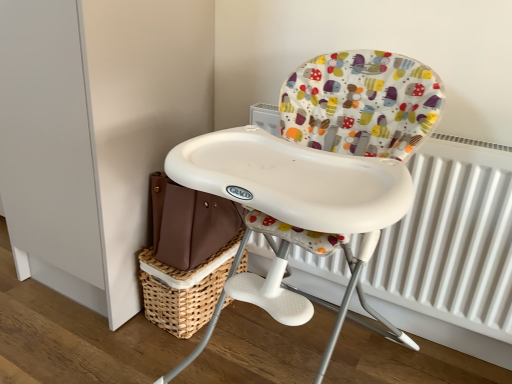
Question: Does white plastic highchair at center have a lesser height compared to woven brown basket at lower center?

Choices:
 (A) yes
 (B) no

Answer: (B)

Question: Is white plastic highchair at center thinner than woven brown basket at lower center?

Choices:
 (A) yes
 (B) no

Answer: (B)

Question: From a real-world perspective, is white plastic highchair at center positioned under woven brown basket at lower center based on gravity?

Choices:
 (A) yes
 (B) no

Answer: (B)

Question: Does white plastic highchair at center lie behind woven brown basket at lower center?

Choices:
 (A) yes
 (B) no

Answer: (B)

Question: Would you say white plastic highchair at center contains woven brown basket at lower center?

Choices:
 (A) no
 (B) yes

Answer: (A)

Question: From the image's perspective, is woven brown basket at lower center located above or below white metallic radiator at right?

Choices:
 (A) below
 (B) above

Answer: (A)

Question: Considering the positions of woven brown basket at lower center and white metallic radiator at right in the image, is woven brown basket at lower center bigger or smaller than white metallic radiator at right?

Choices:
 (A) small
 (B) big

Answer: (A)

Question: Is point (205, 271) positioned closer to the camera than point (481, 314)?

Choices:
 (A) closer
 (B) farther

Answer: (B)

Question: In terms of height, does woven brown basket at lower center look taller or shorter compared to white metallic radiator at right?

Choices:
 (A) short
 (B) tall

Answer: (A)

Question: In the image, is woven brown basket at lower center on the left side or the right side of white plastic highchair at center?

Choices:
 (A) left
 (B) right

Answer: (A)

Question: Does point (187, 307) appear closer or farther from the camera than point (339, 62)?

Choices:
 (A) closer
 (B) farther

Answer: (B)

Question: From a real-world perspective, is woven brown basket at lower center physically located above or below white plastic highchair at center?

Choices:
 (A) below
 (B) above

Answer: (A)

Question: Based on their sizes in the image, would you say woven brown basket at lower center is bigger or smaller than white plastic highchair at center?

Choices:
 (A) small
 (B) big

Answer: (A)

Question: From a real-world perspective, is white plastic highchair at center positioned above or below woven brown basket at lower center?

Choices:
 (A) below
 (B) above

Answer: (B)

Question: Is point (331, 178) positioned closer to the camera than point (153, 312)?

Choices:
 (A) farther
 (B) closer

Answer: (B)